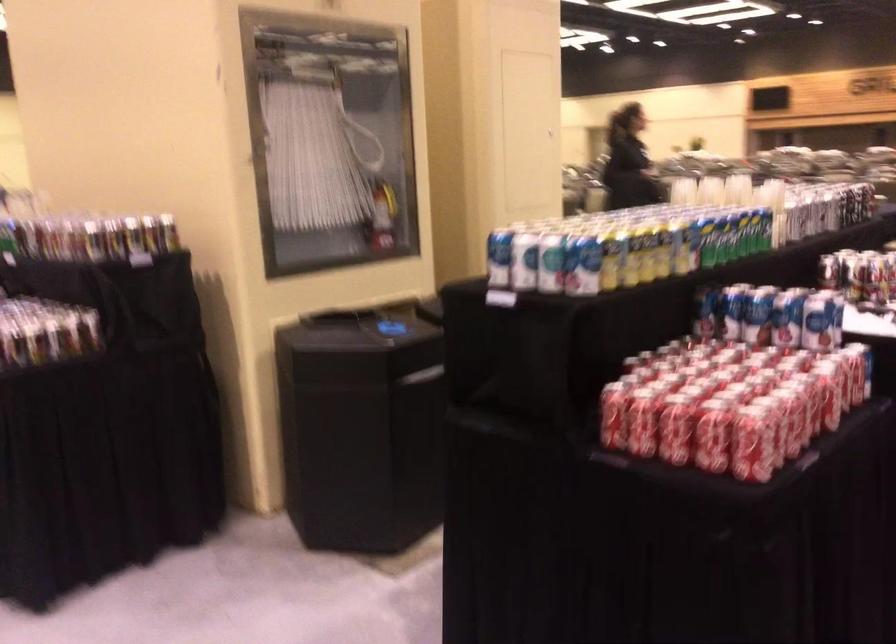
Find where to grip the fire hose nozzle. Please return your answer as a coordinate pair (x, y).

(372, 86)